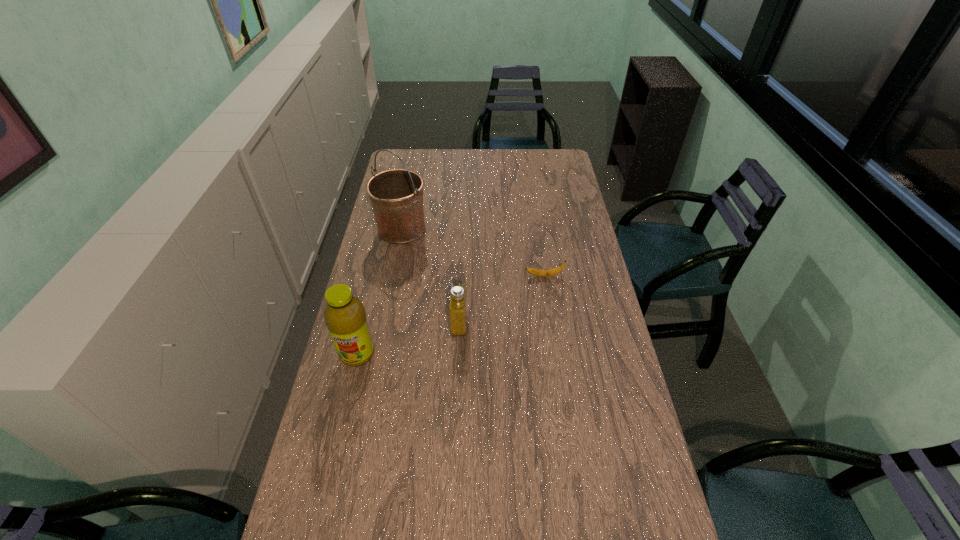
Locate an element on the screen. free space at the far left corner of the desktop is located at coordinates (412, 167).

This screenshot has height=540, width=960. What are the coordinates of `free space at the far right corner of the desktop` in the screenshot? It's located at (551, 158).

The width and height of the screenshot is (960, 540). Find the location of `free space between the second object from right to left and the shortest object`. free space between the second object from right to left and the shortest object is located at coordinates (502, 299).

Where is `vacant space that is in between the tallest object and the second nearest object`? The height and width of the screenshot is (540, 960). vacant space that is in between the tallest object and the second nearest object is located at coordinates (430, 276).

At what (x,y) coordinates should I click in order to perform the action: click on object identified as the closest to the banana. Please return your answer as a coordinate pair (x, y). The width and height of the screenshot is (960, 540). Looking at the image, I should click on (458, 296).

Identify the location of the closest object to the third tallest object. Image resolution: width=960 pixels, height=540 pixels. (345, 316).

The height and width of the screenshot is (540, 960). I want to click on free region that satisfies the following two spatial constraints: 1. on the peel of the banana from the top; 2. on the front label of the third shortest object, so click(556, 354).

I want to click on vacant space that satisfies the following two spatial constraints: 1. on the peel of the rightmost object from the top; 2. on the front label of the nearest object, so click(556, 354).

I want to click on vacant position in the image that satisfies the following two spatial constraints: 1. on the peel of the shortest object from the top; 2. on the front label of the second tallest object, so click(x=556, y=354).